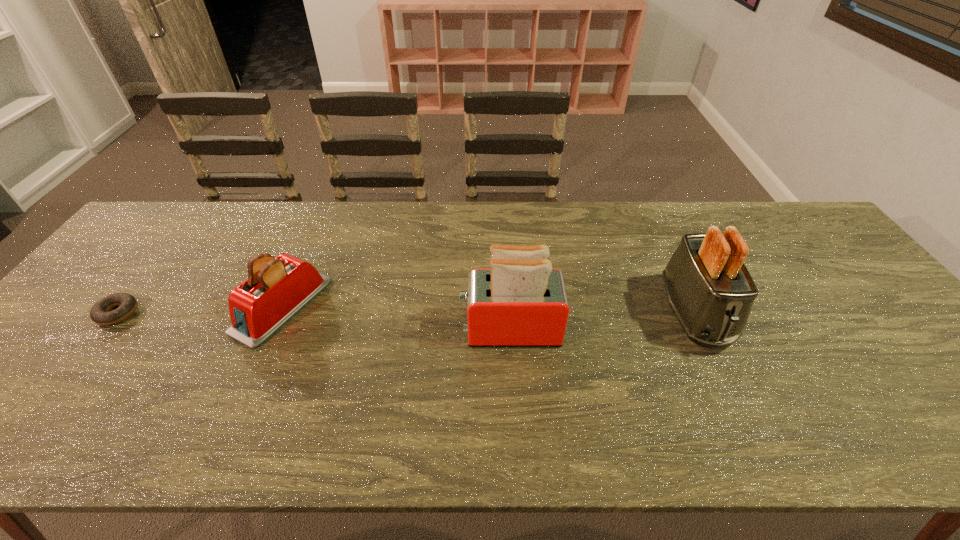
Locate an element on the screen. The image size is (960, 540). vacant region located on the back of the second object from left to right is located at coordinates (308, 247).

Locate an element on the screen. The width and height of the screenshot is (960, 540). vacant area situated 0.230m on the front of the doughnut is located at coordinates [41, 411].

At what (x,y) coordinates should I click in order to perform the action: click on object situated at the left edge. Please return your answer as a coordinate pair (x, y). This screenshot has width=960, height=540. Looking at the image, I should click on (99, 314).

Find the location of `vacant area at the far edge of the desktop`. vacant area at the far edge of the desktop is located at coordinates (513, 227).

What are the coordinates of `vacant space at the near edge of the desktop` in the screenshot? It's located at (747, 426).

I want to click on free space at the left edge of the desktop, so click(x=161, y=273).

Identify the location of vacant space at the far left corner of the desktop. This screenshot has height=540, width=960. (180, 213).

The image size is (960, 540). I want to click on empty space that is in between the second object from left to right and the leftmost object, so click(x=200, y=310).

Locate an element on the screen. This screenshot has width=960, height=540. vacant area that lies between the rightmost object and the doughnut is located at coordinates (406, 313).

Find the location of a particular element. vacant space in between the leftmost toaster and the second object from right to left is located at coordinates (396, 318).